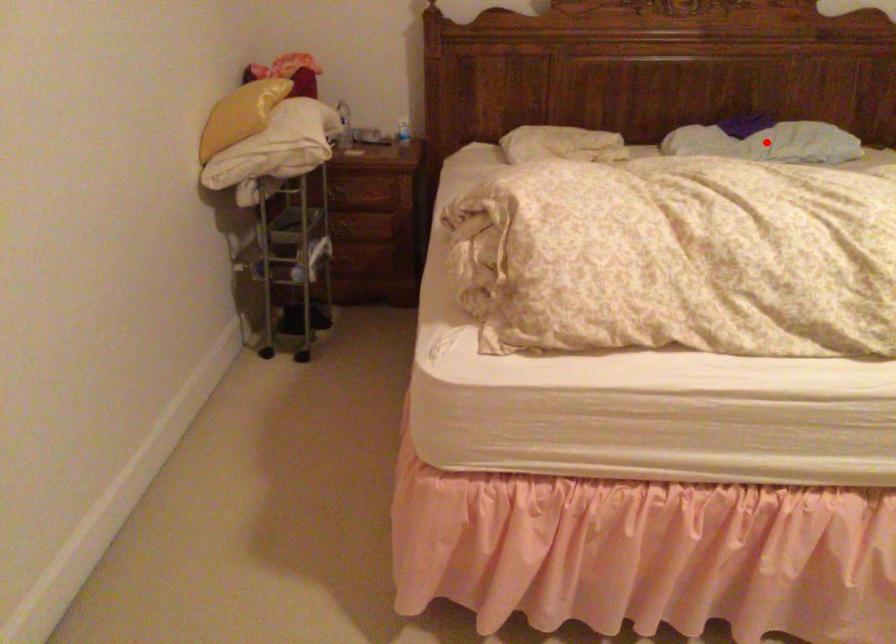
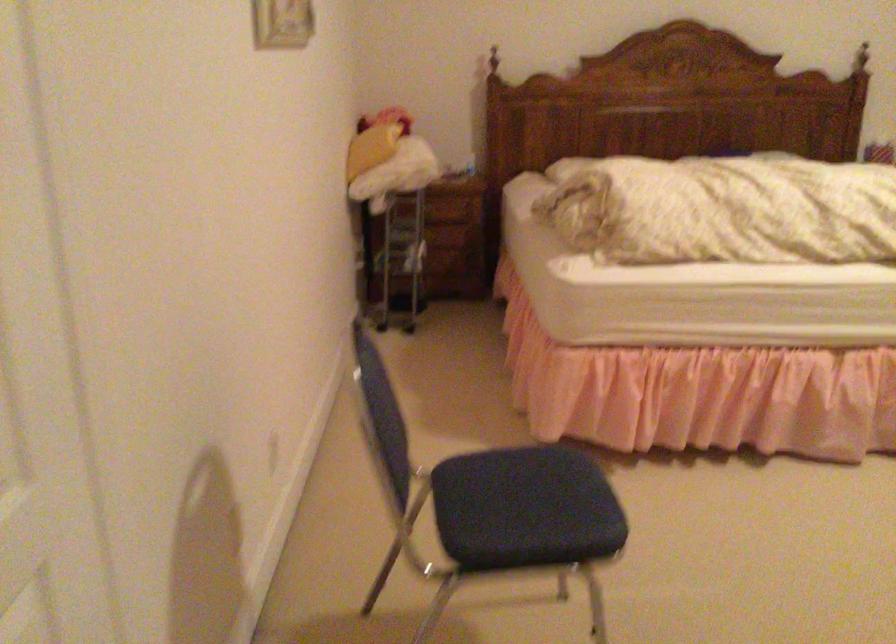
Question: I am providing you with two images of the same scene from different viewpoints. A red point is marked on the first image. Is the red point's position out of view in image 2?

Choices:
 (A) Yes
 (B) No

Answer: (A)